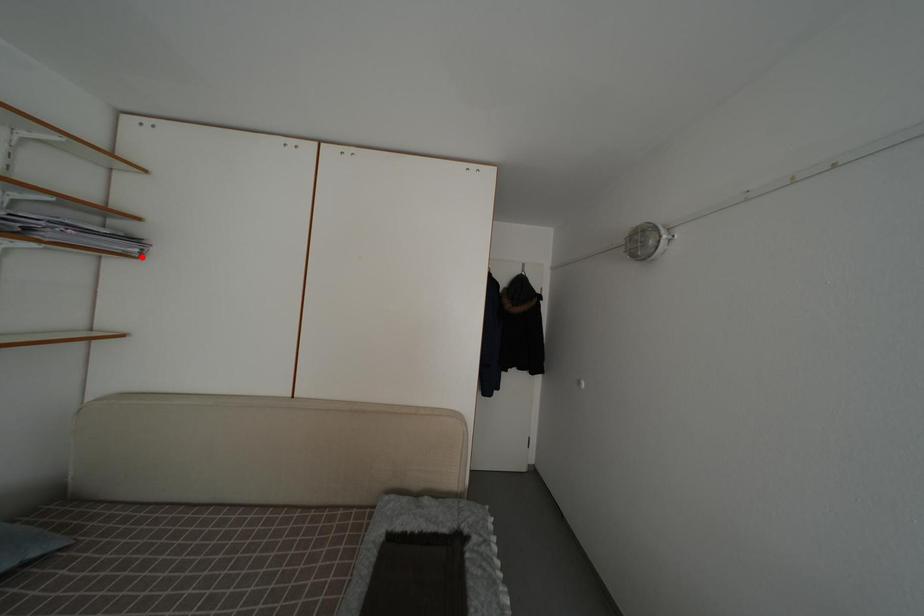
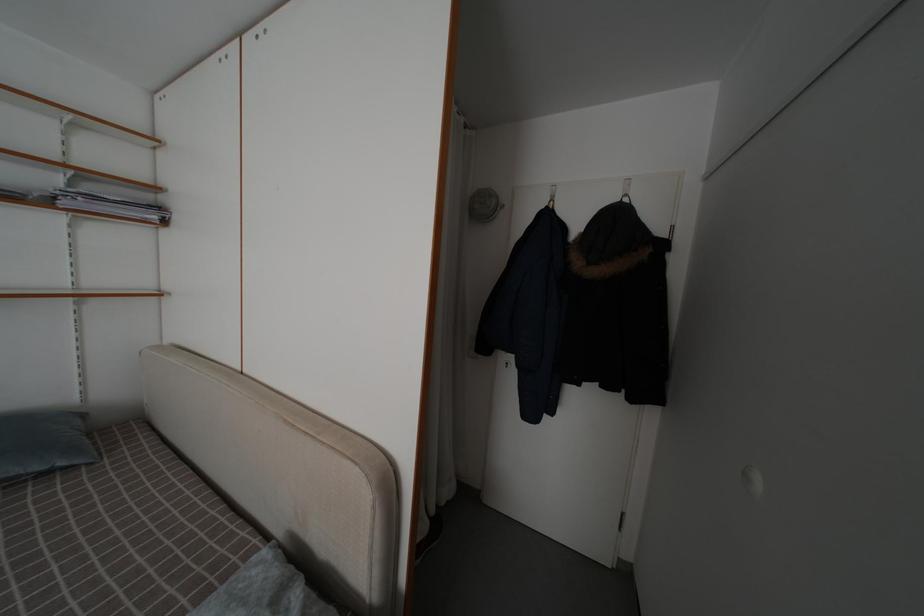
Locate, in the second image, the point that corresponds to the highlighted location in the first image.

(161, 224)